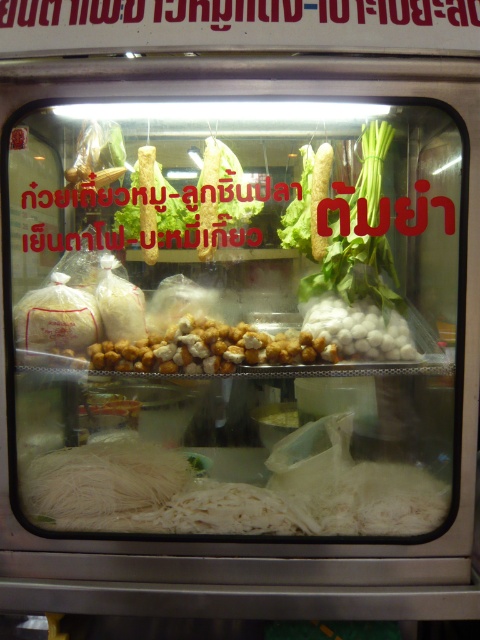
Question: Does green leafy vegetable at right appear on the left side of white glossy balls at center?

Choices:
 (A) yes
 (B) no

Answer: (B)

Question: Considering the real-world distances, which object is farthest from the white glossy balls at center?

Choices:
 (A) golden crispy balls at center
 (B) green leafy vegetable at right

Answer: (A)

Question: Which object is the farthest from the green leafy vegetable at right?

Choices:
 (A) golden crispy balls at center
 (B) white glossy balls at center

Answer: (A)

Question: Estimate the real-world distances between objects in this image. Which object is farther from the golden crispy balls at center?

Choices:
 (A) green leafy vegetable at right
 (B) white glossy balls at center

Answer: (A)

Question: Can you confirm if green leafy vegetable at right is positioned to the right of white glossy balls at center?

Choices:
 (A) no
 (B) yes

Answer: (B)

Question: Is golden crispy balls at center wider than green leafy vegetable at right?

Choices:
 (A) yes
 (B) no

Answer: (A)